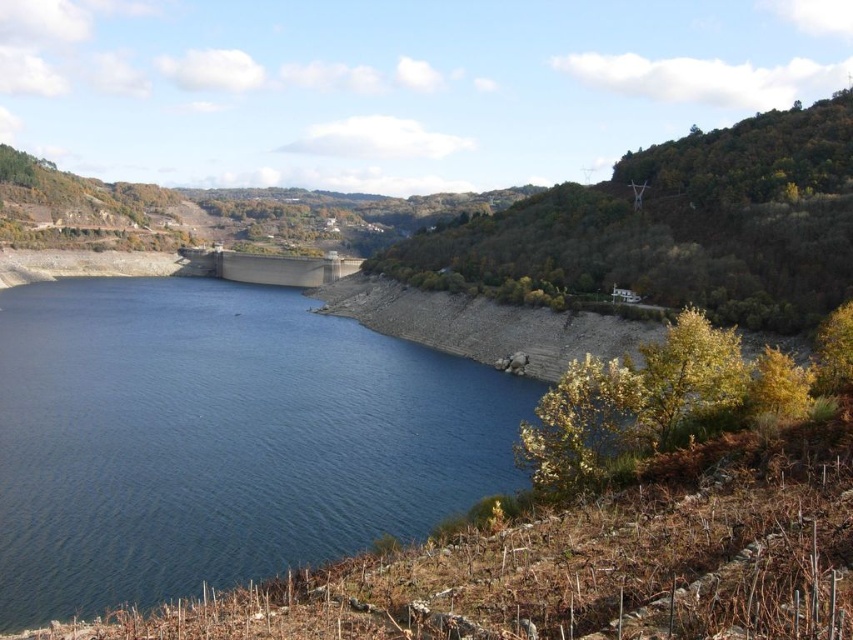
Question: Does blue water at center have a lesser width compared to gray concrete dam at center?

Choices:
 (A) yes
 (B) no

Answer: (B)

Question: Considering the relative positions of blue water at center and gray concrete dam at center in the image provided, where is blue water at center located with respect to gray concrete dam at center?

Choices:
 (A) below
 (B) above

Answer: (A)

Question: Which point is closer to the camera?

Choices:
 (A) blue water at center
 (B) gray concrete dam at center

Answer: (A)

Question: Does blue water at center appear on the right side of gray concrete dam at center?

Choices:
 (A) yes
 (B) no

Answer: (A)